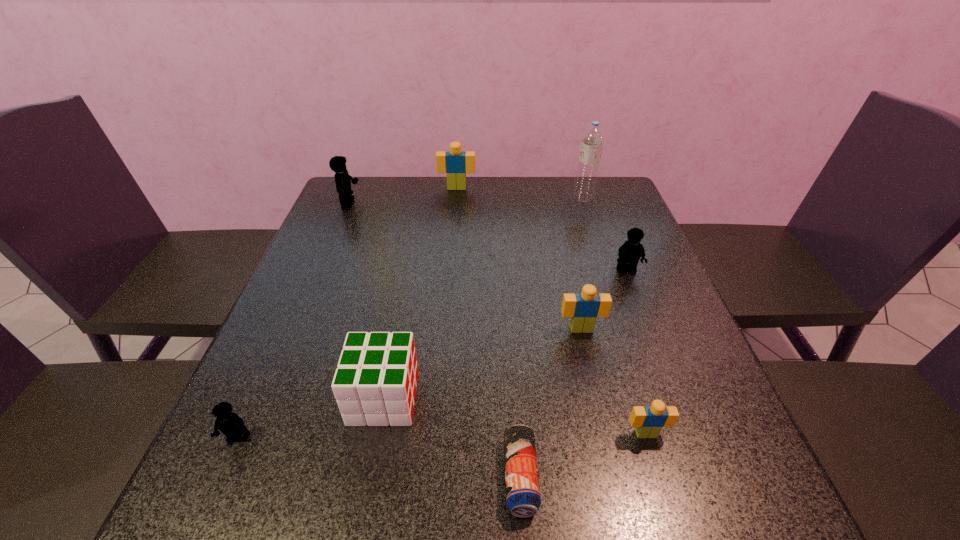
Locate an element on the screen. water bottle is located at coordinates (592, 140).

Locate an element on the screen. the leftmost beige Lego is located at coordinates (455, 163).

The height and width of the screenshot is (540, 960). Identify the location of the biggest beige Lego. (455, 163).

Locate an element on the screen. the fifth nearest Lego is located at coordinates (337, 164).

The width and height of the screenshot is (960, 540). I want to click on the farthest yellow Lego, so click(337, 164).

This screenshot has width=960, height=540. In order to click on the fourth farthest Lego in this screenshot , I will do point(584,308).

What are the coordinates of `the second farthest beige Lego` in the screenshot? It's located at (584, 308).

Locate an element on the screen. The height and width of the screenshot is (540, 960). the sixth nearest object is located at coordinates (630, 252).

This screenshot has width=960, height=540. Identify the location of the second farthest yellow Lego. (630, 252).

At what (x,y) coordinates should I click in order to perform the action: click on the fourth nearest object. Please return your answer as a coordinate pair (x, y). Looking at the image, I should click on (375, 383).